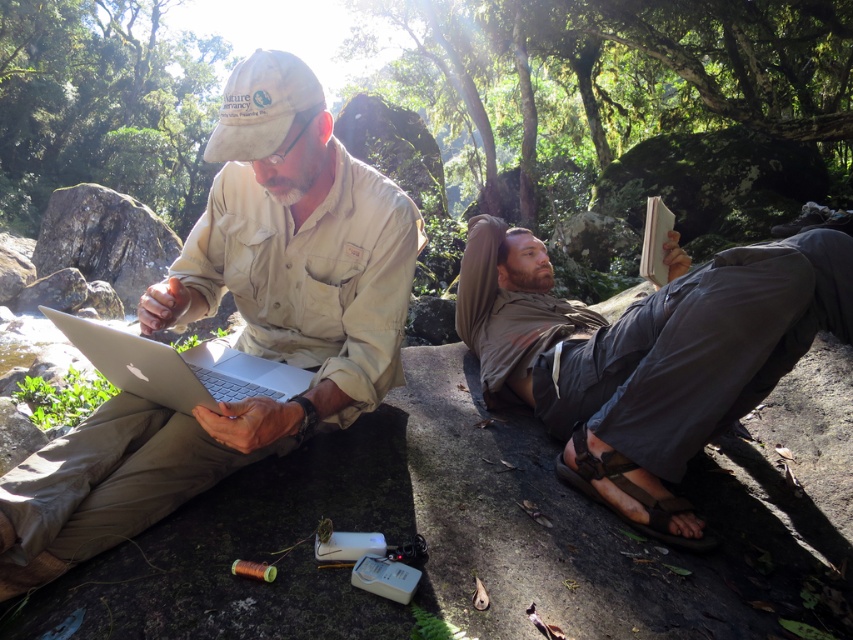
Question: Does matte khaki shirt at center come behind brown leather sandal at lower center?

Choices:
 (A) yes
 (B) no

Answer: (B)

Question: Which point appears farthest from the camera in this image?

Choices:
 (A) (263, 76)
 (B) (492, 333)
 (C) (129, 355)

Answer: (B)

Question: Does matte khaki shirt at center appear on the right side of khaki cotton pants at center?

Choices:
 (A) yes
 (B) no

Answer: (B)

Question: Which is nearer to the brown leather sandal at lower center?

Choices:
 (A) matte khaki shirt at center
 (B) silver metallic laptop at center
 (C) khaki cotton pants at center

Answer: (C)

Question: Which point appears closest to the camera in this image?

Choices:
 (A) (467, 260)
 (B) (582, 490)
 (C) (369, 364)
 (D) (99, 364)

Answer: (D)

Question: Is matte khaki shirt at center positioned at the back of brown leather sandal at lower center?

Choices:
 (A) no
 (B) yes

Answer: (A)